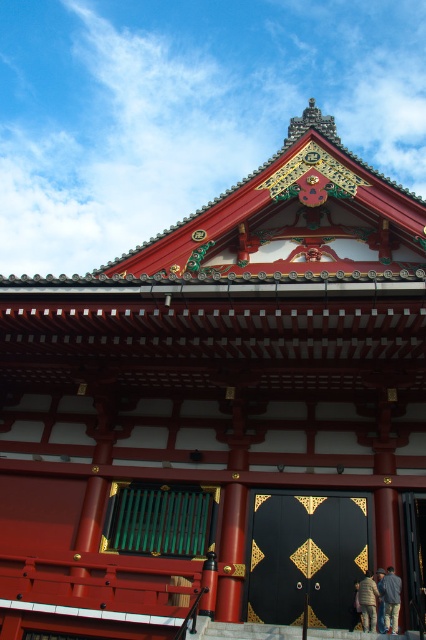
Who is higher up, black polished wood door at center or light brown leather jacket at lower right?

black polished wood door at center is above.

Which is behind, point (301, 512) or point (362, 588)?

The point (301, 512) is behind.

Locate an element on the screen. This screenshot has height=640, width=426. black polished wood door at center is located at coordinates (305, 557).

What do you see at coordinates (305, 557) in the screenshot? I see `black polished wood door at center` at bounding box center [305, 557].

Who is more distant from viewer, (259, 506) or (394, 576)?

The point (259, 506) is behind.

Measure the distance between point (250, 536) and camera.

Point (250, 536) is 98.15 feet away from camera.

What are the coordinates of `black polished wood door at center` in the screenshot? It's located at (305, 557).

Is denim jacket at lower right wider than light brown leather jacket at lower right?

Correct, the width of denim jacket at lower right exceeds that of light brown leather jacket at lower right.

Which is more to the left, denim jacket at lower right or light brown leather jacket at lower right?

From the viewer's perspective, light brown leather jacket at lower right appears more on the left side.

Which is in front, point (393, 596) or point (360, 600)?

Point (393, 596) is in front.

Locate an element on the screen. This screenshot has height=640, width=426. denim jacket at lower right is located at coordinates (391, 598).